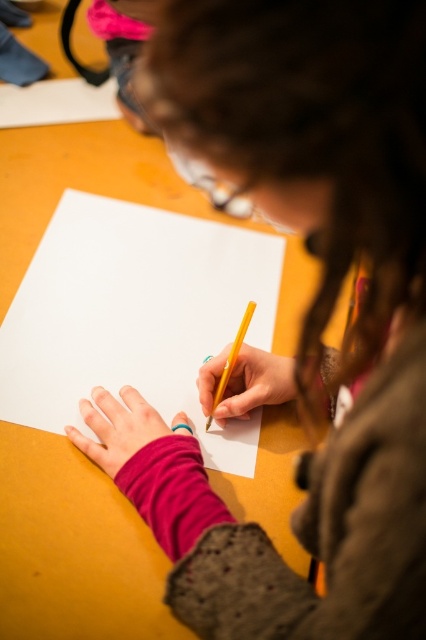
You have a small toy car that is 10 cm long. You want to place it on the wooden table at center so that it doesn t fall off. Considering the white paper at center is already on the table, where should you place the toy car?

The wooden table at center is larger in size than white paper at center, so you should place the toy car on the area of the wooden table at center that is not covered by the white paper at center to ensure it doesn t fall off.

You are a photographer setting up a shot of the wooden table at center and the white paper at center. You want to ensure both are in focus. Considering their heights, which one should you adjust the focus on first?

The wooden table at center is taller than the white paper at center. To ensure both are in focus, adjust the focus starting with the wooden table at center since it is higher and likely further away from the camera.